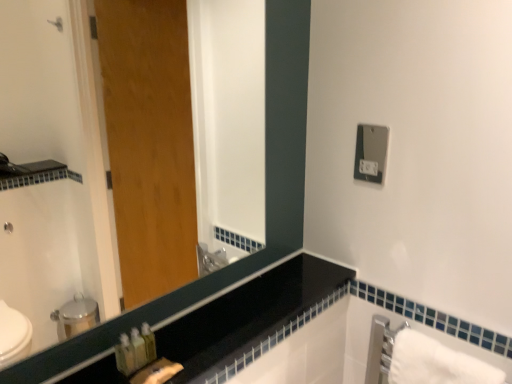
Question: Is black glass mirror at upper left aimed at satin silver outlet at upper right?

Choices:
 (A) yes
 (B) no

Answer: (B)

Question: From a real-world perspective, is black glass mirror at upper left positioned under satin silver outlet at upper right based on gravity?

Choices:
 (A) yes
 (B) no

Answer: (B)

Question: Can we say black glass mirror at upper left lies outside satin silver outlet at upper right?

Choices:
 (A) no
 (B) yes

Answer: (B)

Question: Is black glass mirror at upper left behind satin silver outlet at upper right?

Choices:
 (A) yes
 (B) no

Answer: (B)

Question: Does black glass mirror at upper left lie in front of satin silver outlet at upper right?

Choices:
 (A) yes
 (B) no

Answer: (A)

Question: Is black glass mirror at upper left wider or thinner than satin silver outlet at upper right?

Choices:
 (A) thin
 (B) wide

Answer: (B)

Question: From a real-world perspective, relative to satin silver outlet at upper right, is black glass mirror at upper left vertically above or below?

Choices:
 (A) below
 (B) above

Answer: (B)

Question: Is black glass mirror at upper left bigger or smaller than satin silver outlet at upper right?

Choices:
 (A) small
 (B) big

Answer: (B)

Question: Relative to satin silver outlet at upper right, is black glass mirror at upper left in front or behind?

Choices:
 (A) behind
 (B) front

Answer: (B)

Question: Looking at their shapes, would you say white cotton bath towel at lower right is wider or thinner than black glass mirror at upper left?

Choices:
 (A) thin
 (B) wide

Answer: (A)

Question: In terms of size, does white cotton bath towel at lower right appear bigger or smaller than black glass mirror at upper left?

Choices:
 (A) small
 (B) big

Answer: (A)

Question: From the image's perspective, is white cotton bath towel at lower right located above or below black glass mirror at upper left?

Choices:
 (A) below
 (B) above

Answer: (A)

Question: Visually, is white cotton bath towel at lower right positioned to the left or to the right of black glass mirror at upper left?

Choices:
 (A) left
 (B) right

Answer: (B)

Question: Considering the positions of point (373, 137) and point (437, 375), is point (373, 137) closer or farther from the camera than point (437, 375)?

Choices:
 (A) closer
 (B) farther

Answer: (B)

Question: In terms of size, does satin silver outlet at upper right appear bigger or smaller than white cotton bath towel at lower right?

Choices:
 (A) big
 (B) small

Answer: (B)